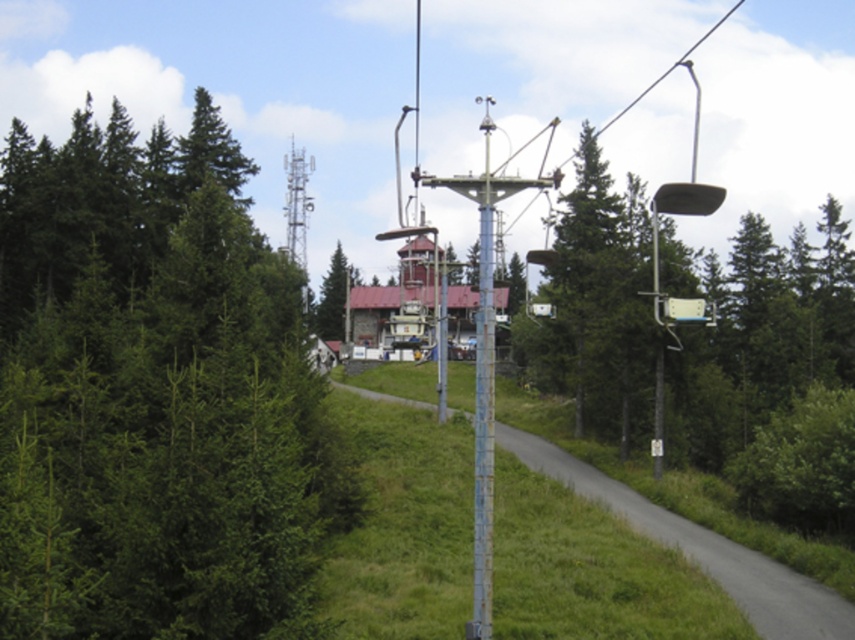
You are a hiker planning to take a photo of the rusty metal pole at center from the green matte tree at left. Is the tree blocking your view of the pole?

The green matte tree at left is below the rusty metal pole at center, so the tree is not blocking the view of the pole as it is positioned lower in the frame.

You are standing at the center of the image and see the point marked at coordinate [154,394]. What object is located at that point?

The point at coordinate [154,394] indicates a green matte tree at left.